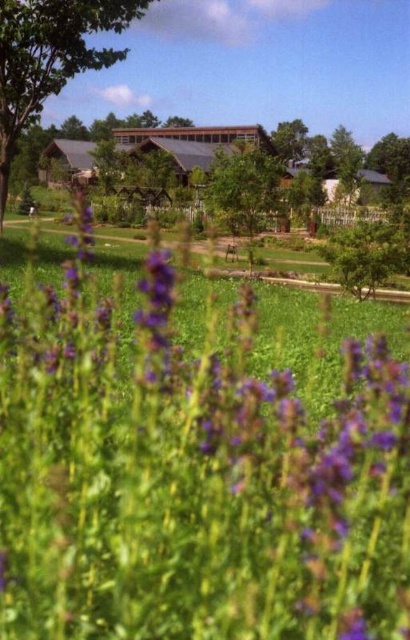
In the scene shown: Which is above, purple matte flower at center or green leafy tree at upper left?

Positioned higher is green leafy tree at upper left.

Is point (139, 356) farther from camera compared to point (70, 68)?

No, it is not.

In order to click on purple matte flower at center in this screenshot , I will do `click(191, 476)`.